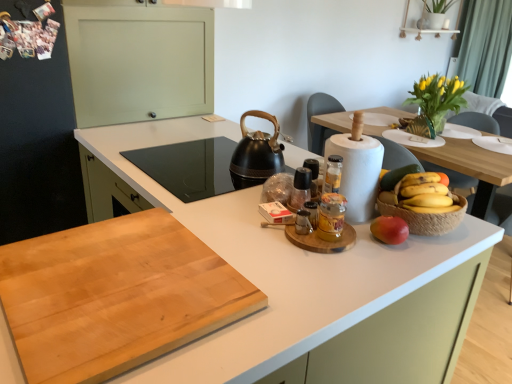
Question: Choose the correct answer: Is green matte grapefruit at right inside black rubberized kettle at center or outside it?

Choices:
 (A) outside
 (B) inside

Answer: (A)

Question: In the image, is green matte grapefruit at right positioned in front of or behind black rubberized kettle at center?

Choices:
 (A) behind
 (B) front

Answer: (B)

Question: Estimate the real-world distances between objects in this image. Which object is closer to the green fabric curtain at upper right?

Choices:
 (A) white matte countertop at center, acting as the first countertop starting from the bottom
 (B) red matte apple at right
 (C) yellow matte bananas at right
 (D) translucent glass jar at center, which is the 2th bottle from back to front
 (E) wooden bowl of fruit at center

Answer: (E)

Question: Which object is positioned closest to the red matte apple at right?

Choices:
 (A) green matte grapefruit at right
 (B) natural wood cutting board at center, arranged as the 1th countertop when viewed from the top
 (C) green fabric curtain at upper right
 (D) translucent glass jar at center, which is the 2th bottle from back to front
 (E) black rubberized kettle at center

Answer: (A)